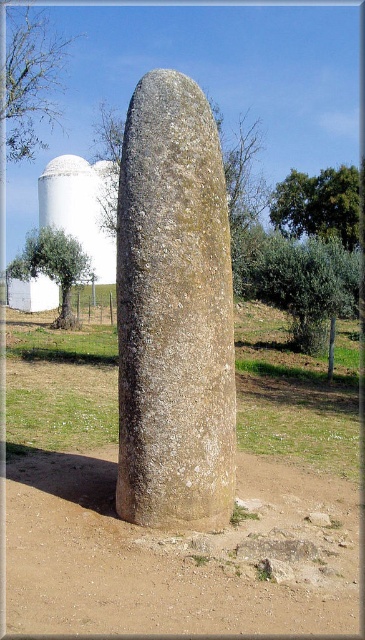
Question: Is speckled stone monolith at center closer to camera compared to green leafy tree at upper right?

Choices:
 (A) no
 (B) yes

Answer: (B)

Question: Estimate the real-world distances between objects in this image. Which object is farther from the green leafy tree at upper right?

Choices:
 (A) white smooth water tower at left
 (B) green leafy tree at left
 (C) bare branches at upper left

Answer: (C)

Question: Does bare branches at upper left appear on the right side of green leafy tree at upper right?

Choices:
 (A) no
 (B) yes

Answer: (A)

Question: Can you confirm if brown sandy dirt at center is bigger than white smooth water tower at left?

Choices:
 (A) no
 (B) yes

Answer: (B)

Question: Which object is closer to the camera taking this photo?

Choices:
 (A) white smooth water tower at left
 (B) bare branches at upper left

Answer: (B)

Question: Which of the following is the closest to the observer?

Choices:
 (A) bare branches at upper left
 (B) speckled stone monolith at center
 (C) white smooth water tower at left
 (D) green leafy tree at left

Answer: (B)